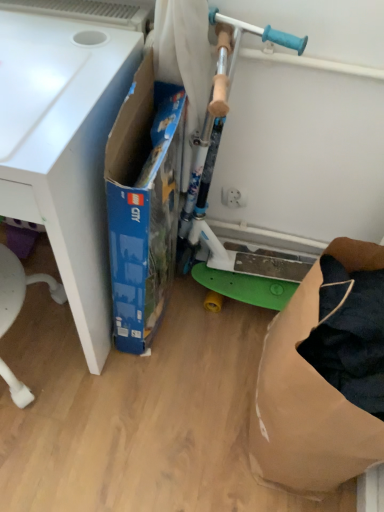
Find the location of `vacant region to the right of blue cardboard box at center`. vacant region to the right of blue cardboard box at center is located at coordinates (205, 335).